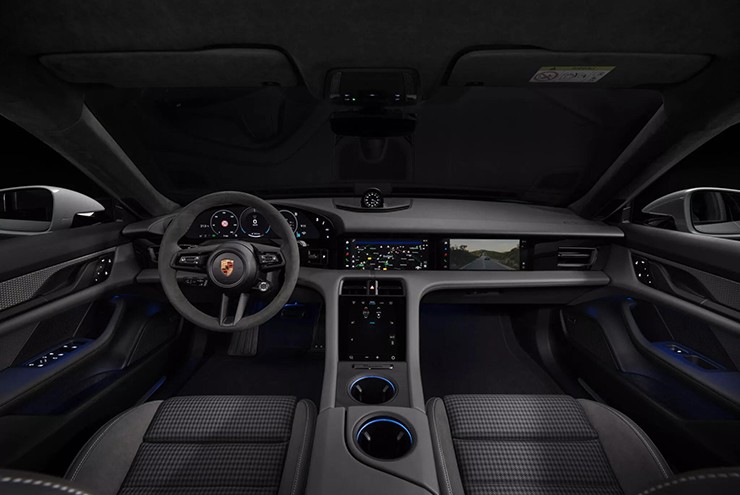
Find the location of a particular element. This screenshot has height=495, width=740. display screen is located at coordinates (484, 253).